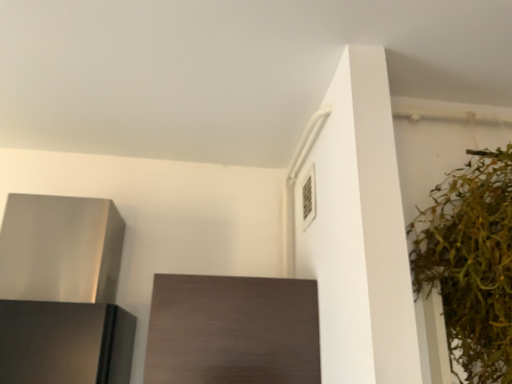
Question: Is dark wood cabinet at center turned away from satin silver range hood at left?

Choices:
 (A) yes
 (B) no

Answer: (B)

Question: Are dark wood cabinet at center and satin silver range hood at left beside each other?

Choices:
 (A) no
 (B) yes

Answer: (A)

Question: From the image's perspective, does dark wood cabinet at center appear higher than satin silver range hood at left?

Choices:
 (A) yes
 (B) no

Answer: (B)

Question: Considering the relative sizes of dark wood cabinet at center and satin silver range hood at left in the image provided, is dark wood cabinet at center bigger than satin silver range hood at left?

Choices:
 (A) yes
 (B) no

Answer: (B)

Question: Is dark wood cabinet at center smaller than satin silver range hood at left?

Choices:
 (A) yes
 (B) no

Answer: (A)

Question: Looking at their shapes, would you say dark wood cabinet at center is wider or thinner than satin silver range hood at left?

Choices:
 (A) wide
 (B) thin

Answer: (B)

Question: Is dark wood cabinet at center to the left or to the right of satin silver range hood at left in the image?

Choices:
 (A) right
 (B) left

Answer: (A)

Question: Considering the positions of dark wood cabinet at center and satin silver range hood at left in the image, is dark wood cabinet at center taller or shorter than satin silver range hood at left?

Choices:
 (A) short
 (B) tall

Answer: (A)

Question: Is point (165, 372) positioned closer to the camera than point (35, 196)?

Choices:
 (A) closer
 (B) farther

Answer: (A)

Question: Based on their positions, is green leafy plant at right located to the left or right of satin silver range hood at left?

Choices:
 (A) left
 (B) right

Answer: (B)

Question: From the image's perspective, is green leafy plant at right located above or below satin silver range hood at left?

Choices:
 (A) below
 (B) above

Answer: (B)

Question: Based on their sizes in the image, would you say green leafy plant at right is bigger or smaller than satin silver range hood at left?

Choices:
 (A) small
 (B) big

Answer: (B)

Question: From their relative heights in the image, would you say green leafy plant at right is taller or shorter than satin silver range hood at left?

Choices:
 (A) tall
 (B) short

Answer: (A)

Question: From their relative heights in the image, would you say green leafy plant at right is taller or shorter than dark wood cabinet at center?

Choices:
 (A) tall
 (B) short

Answer: (A)

Question: Is point (466, 173) positioned closer to the camera than point (200, 294)?

Choices:
 (A) closer
 (B) farther

Answer: (A)